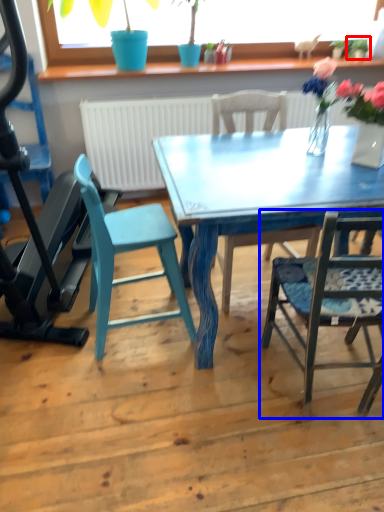
Question: Which object is further to the camera taking this photo, plant (highlighted by a red box) or chair (highlighted by a blue box)?

Choices:
 (A) plant
 (B) chair

Answer: (A)